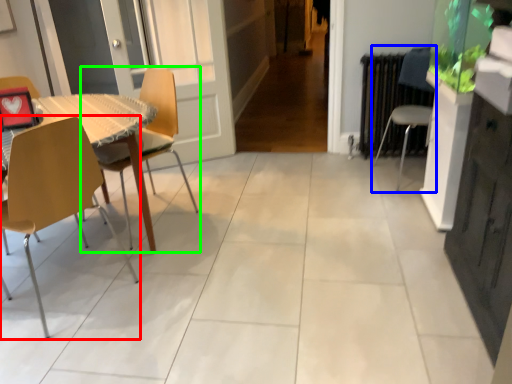
Question: Based on their relative distances, which object is nearer to chair (highlighted by a red box)? Choose from chair (highlighted by a blue box) and chair (highlighted by a green box).

Choices:
 (A) chair
 (B) chair

Answer: (B)